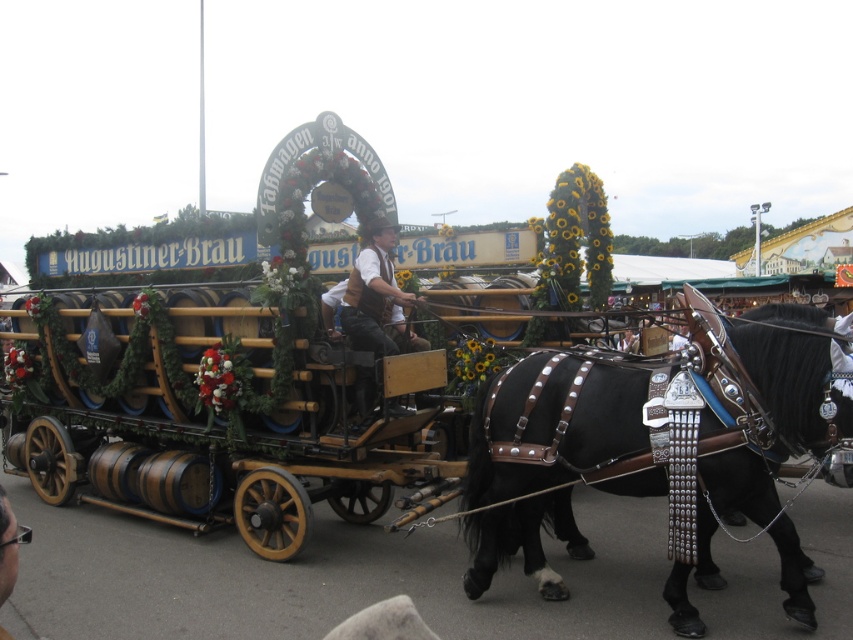
Question: Does black leather harness at center appear on the left side of matte brown vest at center?

Choices:
 (A) no
 (B) yes

Answer: (A)

Question: Which point is farther to the camera?

Choices:
 (A) matte brown vest at center
 (B) black leather harness at center

Answer: (A)

Question: Is black leather harness at center further to camera compared to matte brown vest at center?

Choices:
 (A) no
 (B) yes

Answer: (A)

Question: Which of the following is the closest to the observer?

Choices:
 (A) (370, 394)
 (B) (613, 385)

Answer: (B)

Question: From the image, what is the correct spatial relationship of black leather harness at center in relation to matte brown vest at center?

Choices:
 (A) above
 (B) below

Answer: (B)

Question: Which point appears farthest from the camera in this image?

Choices:
 (A) (669, 499)
 (B) (390, 248)

Answer: (B)